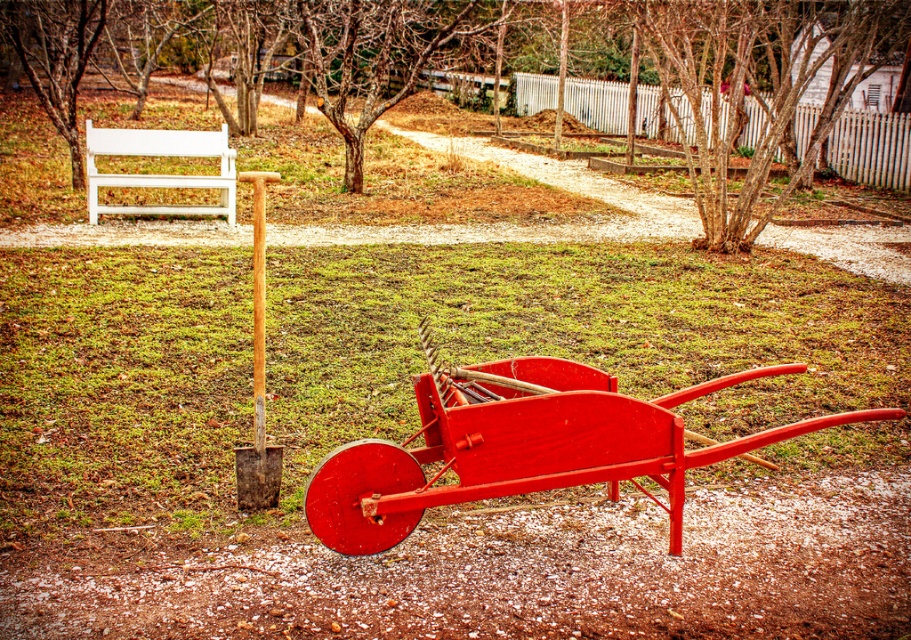
Can you confirm if brown textured tree at center is wider than smooth bark tree at center?

Yes, brown textured tree at center is wider than smooth bark tree at center.

Is brown textured tree at center further to camera compared to smooth bark tree at center?

That is True.

Is point (336, 44) farther from camera compared to point (689, 148)?

Yes, it is behind point (689, 148).

This screenshot has width=911, height=640. I want to click on brown textured tree at center, so click(751, 88).

Is green grass at center wider than white painted wood bench at upper left?

In fact, green grass at center might be narrower than white painted wood bench at upper left.

In order to click on green grass at center in this screenshot , I will do `click(568, 333)`.

Can you confirm if brown textured tree at center is smaller than white painted wood bench at upper left?

No.

Between brown textured tree at center and white painted wood bench at upper left, which one appears on the right side from the viewer's perspective?

Positioned to the right is brown textured tree at center.

Image resolution: width=911 pixels, height=640 pixels. What are the coordinates of `brown textured tree at center` in the screenshot? It's located at (751, 88).